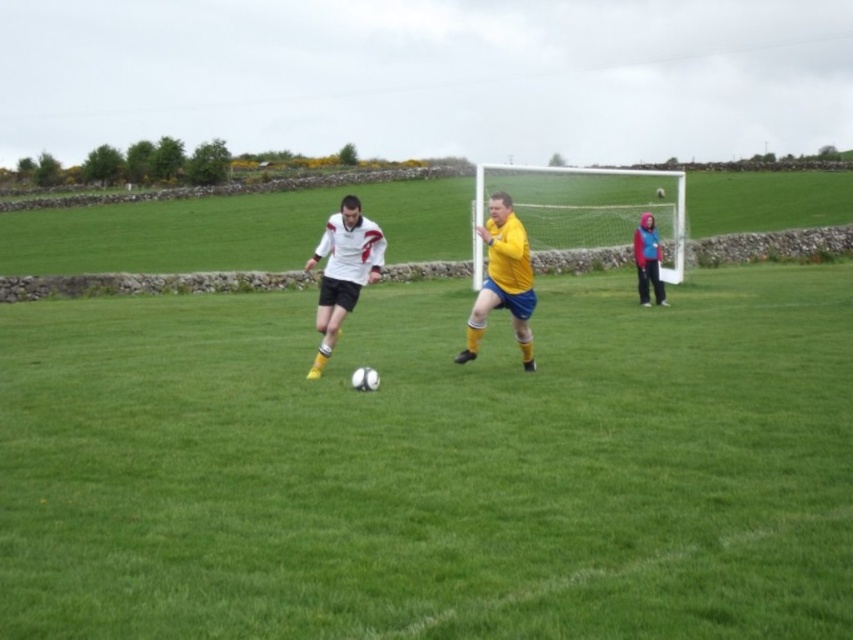
Does yellow matte jersey at center appear on the left side of blue fleece jacket at upper right?

Correct, you'll find yellow matte jersey at center to the left of blue fleece jacket at upper right.

Can you confirm if yellow matte jersey at center is shorter than blue fleece jacket at upper right?

No, yellow matte jersey at center is not shorter than blue fleece jacket at upper right.

I want to click on yellow matte jersey at center, so click(503, 280).

What do you see at coordinates (343, 272) in the screenshot?
I see `white matte jersey at center` at bounding box center [343, 272].

Find the location of `white matte jersey at center`. white matte jersey at center is located at coordinates (343, 272).

Can you confirm if white matte soccer ball at center is positioned to the right of white matte jersey at center?

Yes, white matte soccer ball at center is to the right of white matte jersey at center.

Which is below, white matte soccer ball at center or white matte jersey at center?

white matte soccer ball at center

Is point (149, 326) positioned behind point (347, 259)?

Yes, point (149, 326) is behind point (347, 259).

You are a GUI agent. You are given a task and a screenshot of the screen. Output one action in this format:
    pyautogui.click(x=<x>, y=<y>)
    Task: Click on the white matte soccer ball at center
    The image size is (853, 640).
    Given the screenshot: What is the action you would take?
    pyautogui.click(x=433, y=467)